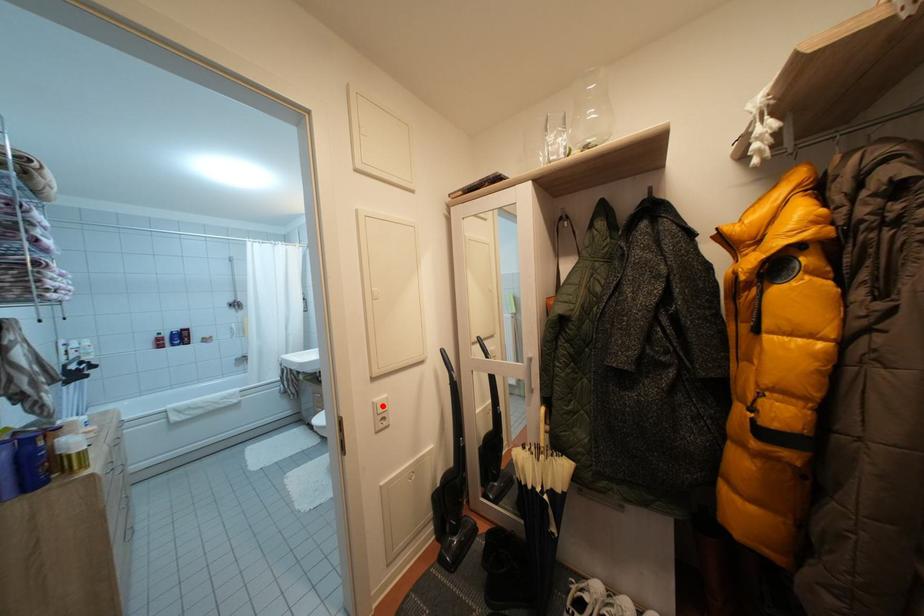
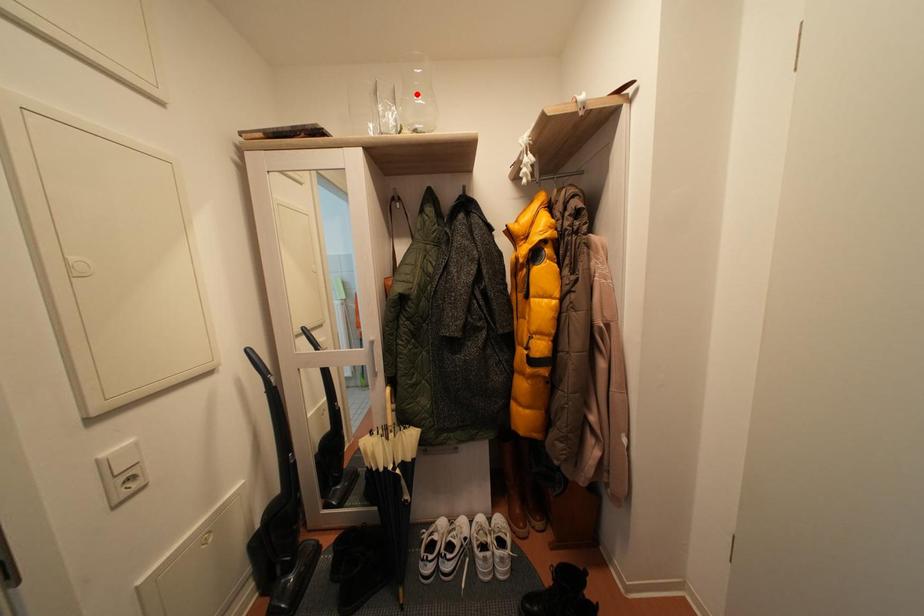
I am providing you with two images of the same scene from different viewpoints. A red point is marked on the first image and another point is marked on the second image. Do the highlighted points in image1 and image2 indicate the same real-world spot?

No